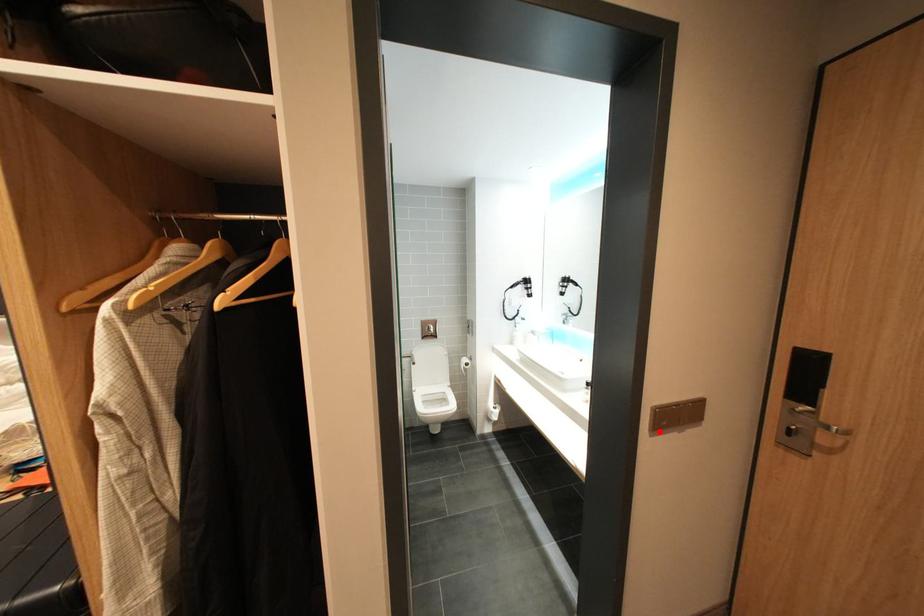
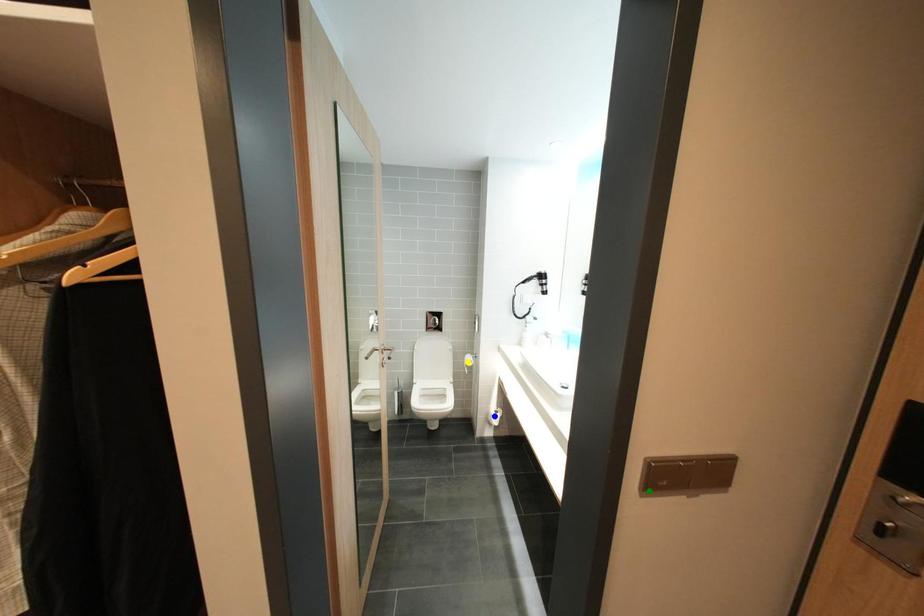
Question: I am providing you with two images of the same scene from different viewpoints. A red point is marked on the first image. You are given multiple points on the second image. Which mark in image 2 goes with the point in image 1?

Choices:
 (A) green point
 (B) blue point
 (C) yellow point

Answer: (A)